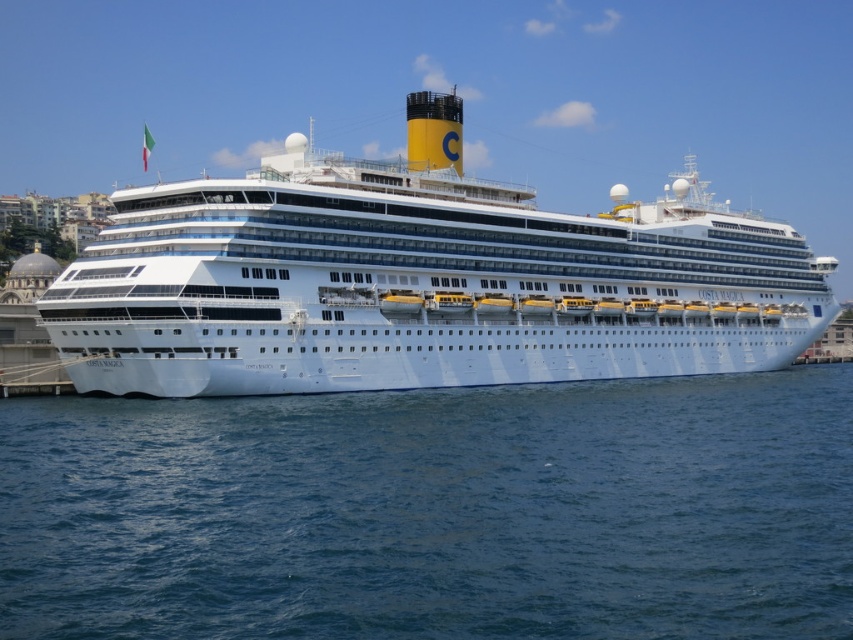
You are standing on the dock next to the Costa Magica cruise ship. You notice a point marked at coordinate (33,492) on the ship. If you want to throw a small object to that point, and your throwing distance is 150 feet, will you be able to reach it?

The point at coordinate (33,492) is 158.48 feet away from you. Since your throwing distance is 150 feet, you cannot reach that point.

You are standing on the dock and looking at the blue water at lower center and the white glossy cruise ship at center. Which object is located below the other?

The blue water at lower center is positioned under the white glossy cruise ship at center, so the blue water at lower center is below the white glossy cruise ship at center.

You are a photographer taking a picture of the blue water at lower center and the white glossy cruise ship at center. Which object appears wider in the photo?

The white glossy cruise ship at center appears wider than the blue water at lower center because the blue water at lower center has a lesser width compared to the white glossy cruise ship at center.